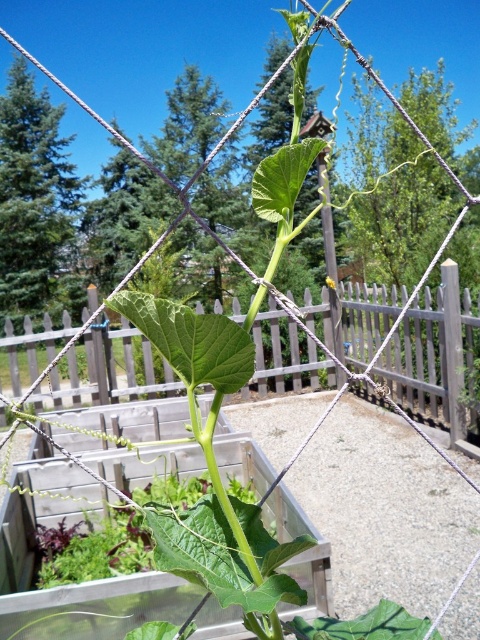
Is wooden at center wider than yellow matte flower at center?

Yes.

Is point (336, 337) positioned before point (332, 282)?

Yes, point (336, 337) is closer to viewer.

Where is `wooden at center`? This screenshot has width=480, height=640. wooden at center is located at coordinates (435, 358).